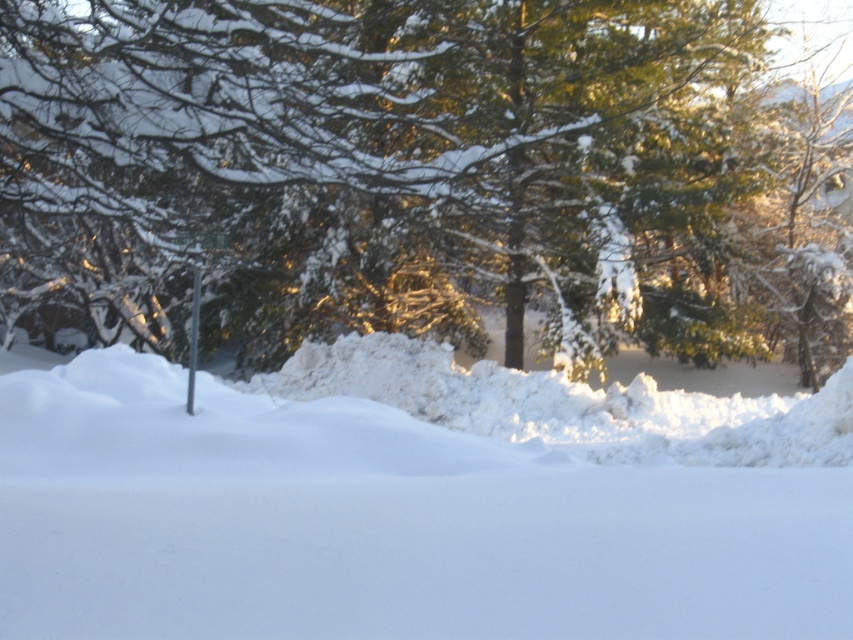
Question: Based on their relative distances, which object is nearer to the white fluffy snow at center?

Choices:
 (A) metallic pole at center
 (B) green textured pine tree at center

Answer: (A)

Question: Can you confirm if green textured pine tree at center is thinner than metallic pole at center?

Choices:
 (A) yes
 (B) no

Answer: (B)

Question: Can you confirm if green textured pine tree at center is positioned above white fluffy snow at center?

Choices:
 (A) no
 (B) yes

Answer: (B)

Question: Which of the following is the closest to the observer?

Choices:
 (A) (154, 124)
 (B) (485, 593)

Answer: (B)

Question: Is green textured pine tree at center positioned in front of white fluffy snow at center?

Choices:
 (A) yes
 (B) no

Answer: (B)

Question: Which is nearer to the metallic pole at center?

Choices:
 (A) white fluffy snow at center
 (B) green textured pine tree at center

Answer: (A)